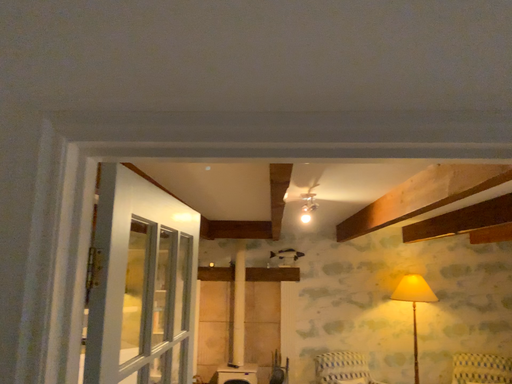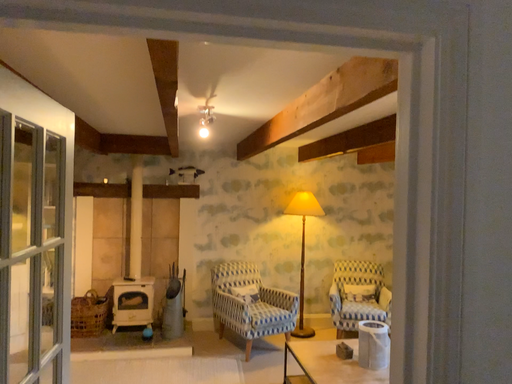
Question: Which way did the camera rotate in the video?

Choices:
 (A) rotated right
 (B) rotated left

Answer: (A)